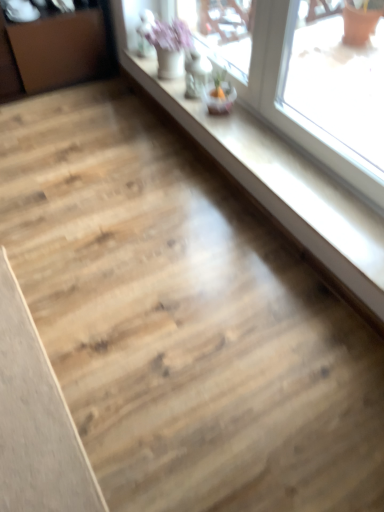
The image size is (384, 512). Identify the location of blank space above light brown wood plank at lower left (from a real-world perspective). (22, 406).